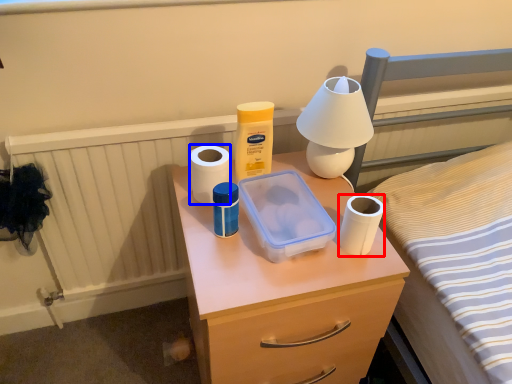
Question: Which object appears farthest to the camera in this image, toilet paper (highlighted by a red box) or toilet paper (highlighted by a blue box)?

Choices:
 (A) toilet paper
 (B) toilet paper

Answer: (B)